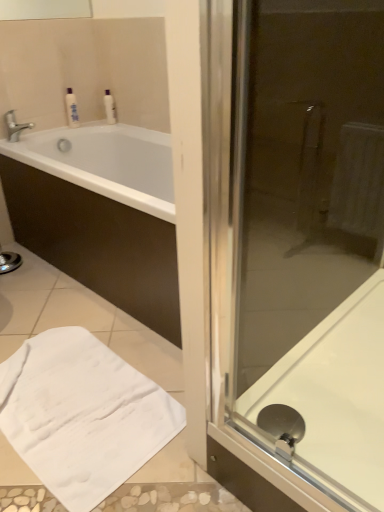
Question: Is silver metallic faucet at upper left not near white glossy bottle at upper left, acting as the 1th toiletry starting from the right?

Choices:
 (A) yes
 (B) no

Answer: (B)

Question: Is silver metallic faucet at upper left thinner than white glossy bottle at upper left, acting as the 1th toiletry starting from the right?

Choices:
 (A) no
 (B) yes

Answer: (A)

Question: Would you say silver metallic faucet at upper left is outside white glossy bottle at upper left, which is the 2th toiletry from left to right?

Choices:
 (A) no
 (B) yes

Answer: (B)

Question: Can you see silver metallic faucet at upper left touching white glossy bottle at upper left, acting as the 1th toiletry starting from the right?

Choices:
 (A) no
 (B) yes

Answer: (A)

Question: From a real-world perspective, is silver metallic faucet at upper left physically above white glossy bottle at upper left, acting as the 1th toiletry starting from the right?

Choices:
 (A) yes
 (B) no

Answer: (B)

Question: Is the position of silver metallic faucet at upper left more distant than that of white glossy bottle at upper left, acting as the 1th toiletry starting from the right?

Choices:
 (A) no
 (B) yes

Answer: (A)

Question: Is white soft towel at lower left facing away from white glossy bottle at upper left, the 2th toiletry when ordered from right to left?

Choices:
 (A) yes
 (B) no

Answer: (B)

Question: Considering the relative positions of white soft towel at lower left and white glossy bottle at upper left, the 2th toiletry when ordered from right to left, in the image provided, is white soft towel at lower left behind white glossy bottle at upper left, the 2th toiletry when ordered from right to left,?

Choices:
 (A) no
 (B) yes

Answer: (A)

Question: Considering the relative sizes of white soft towel at lower left and white glossy bottle at upper left, the first toiletry viewed from the left, in the image provided, is white soft towel at lower left taller than white glossy bottle at upper left, the first toiletry viewed from the left,?

Choices:
 (A) no
 (B) yes

Answer: (A)

Question: From a real-world perspective, is white soft towel at lower left located higher than white glossy bottle at upper left, the first toiletry viewed from the left?

Choices:
 (A) no
 (B) yes

Answer: (A)

Question: Is white soft towel at lower left far away from white glossy bottle at upper left, the 2th toiletry when ordered from right to left?

Choices:
 (A) no
 (B) yes

Answer: (B)

Question: Are white soft towel at lower left and white glossy bottle at upper left, the first toiletry viewed from the left, beside each other?

Choices:
 (A) no
 (B) yes

Answer: (A)

Question: Is white glossy bottle at upper left, which is the 2th toiletry from left to right, thinner than white glossy bath at right?

Choices:
 (A) yes
 (B) no

Answer: (A)